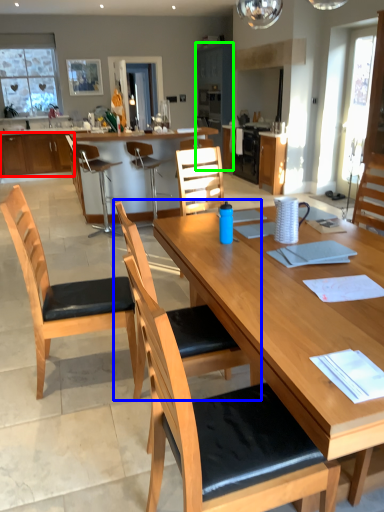
Question: Estimate the real-world distances between objects in this image. Which object is farther from cabinetry (highlighted by a red box), chair (highlighted by a blue box) or cabinetry (highlighted by a green box)?

Choices:
 (A) chair
 (B) cabinetry

Answer: (A)